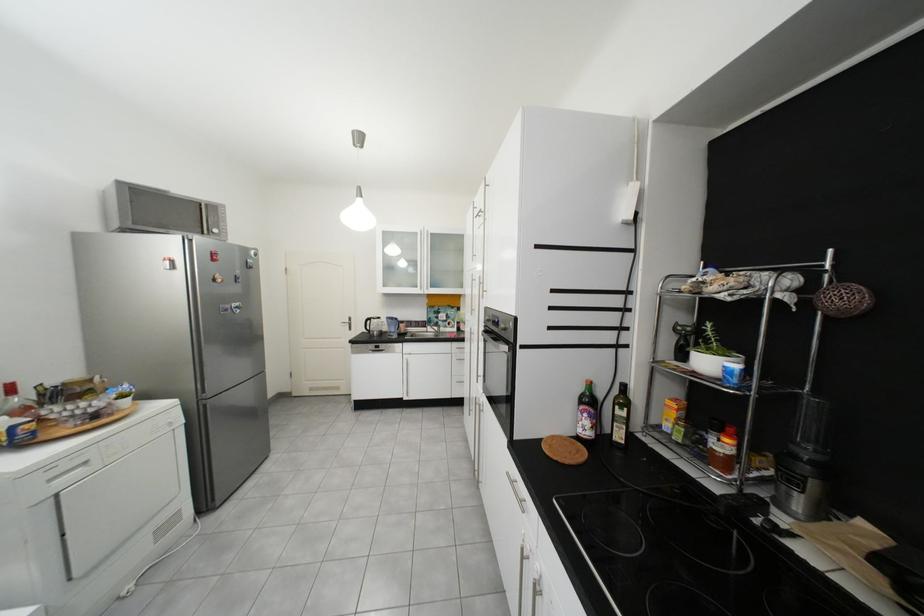
You are a GUI agent. You are given a task and a screenshot of the screen. Output one action in this format:
    pyautogui.click(x=<x>, y=<y>)
    Task: Click on the silver cabinet handle
    
    Given the screenshot: What is the action you would take?
    pyautogui.click(x=516, y=492)